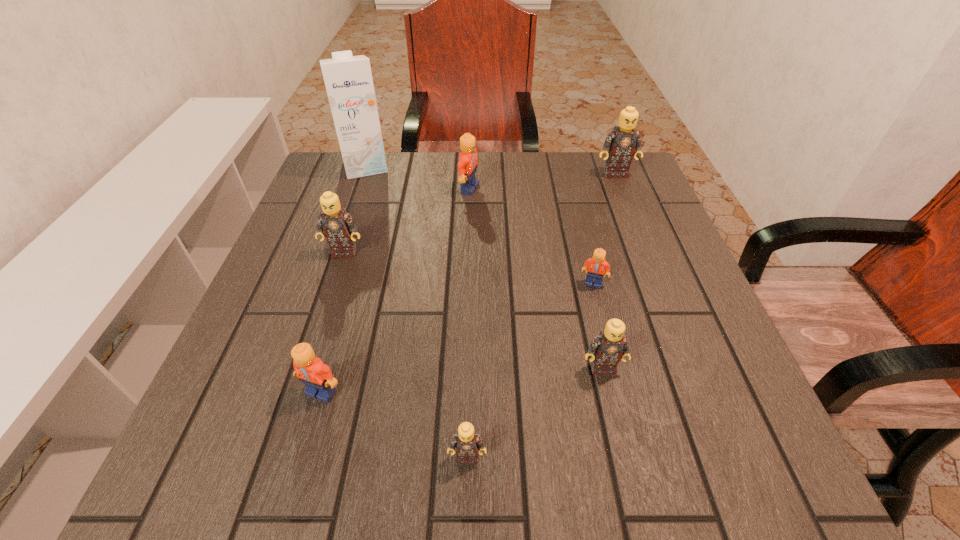
The width and height of the screenshot is (960, 540). Identify the location of the third nearest object. (607, 349).

At what (x,y) coordinates should I click in order to perform the action: click on the smallest orange Lego. Please return your answer as a coordinate pair (x, y). Looking at the image, I should click on (596, 265).

At what (x,y) coordinates should I click in order to perform the action: click on the fourth nearest object. Please return your answer as a coordinate pair (x, y). Looking at the image, I should click on (596, 265).

The height and width of the screenshot is (540, 960). I want to click on the second tan Lego from left to right, so click(467, 442).

This screenshot has width=960, height=540. Find the location of `the smallest tan Lego`. the smallest tan Lego is located at coordinates (467, 442).

Find the location of a particular element. This screenshot has width=960, height=540. vacant space situated 0.270m on the right of the carton is located at coordinates pyautogui.click(x=490, y=166).

Find the location of a particular element. vacant area situated 0.350m in front of the rightmost tan Lego is located at coordinates (654, 272).

You are a GUI agent. You are given a task and a screenshot of the screen. Output one action in this format:
    pyautogui.click(x=<x>, y=<y>)
    Task: Click on the vacant space situated 0.050m on the front-facing side of the farthest orange Lego
    This screenshot has height=540, width=960.
    Given the screenshot: What is the action you would take?
    pyautogui.click(x=498, y=189)

Find the location of a particular element. free space located in front of the second biggest tan Lego is located at coordinates (307, 366).

Where is `free space located on the front-facing side of the leftmost orange Lego`? The image size is (960, 540). free space located on the front-facing side of the leftmost orange Lego is located at coordinates (309, 434).